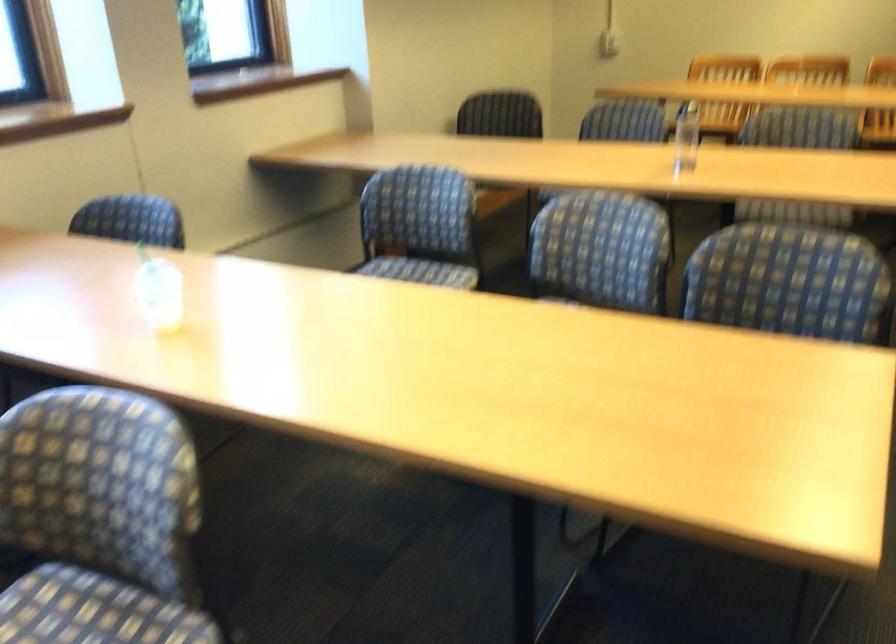
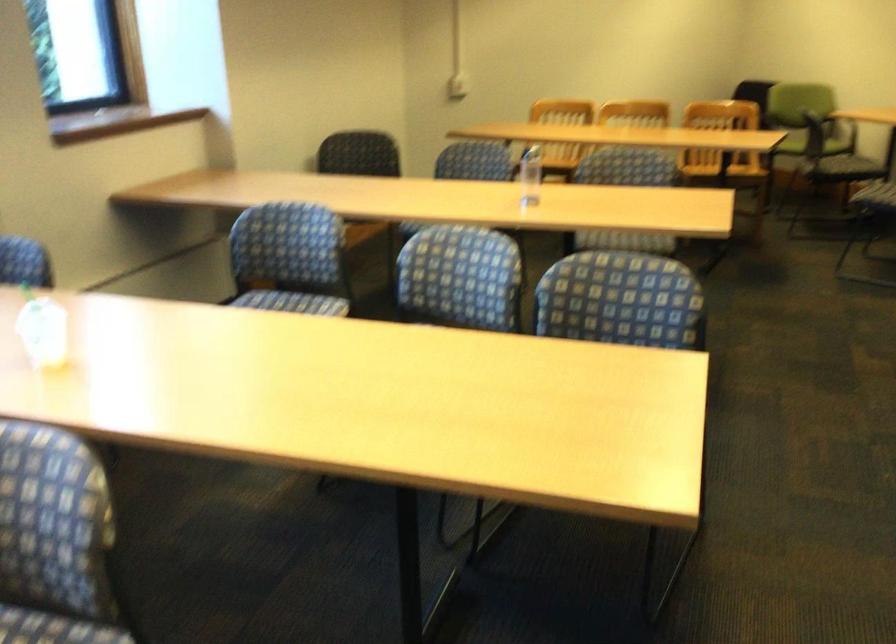
Where in the second image is the point corresponding to pixel 418 225 from the first image?

(289, 259)